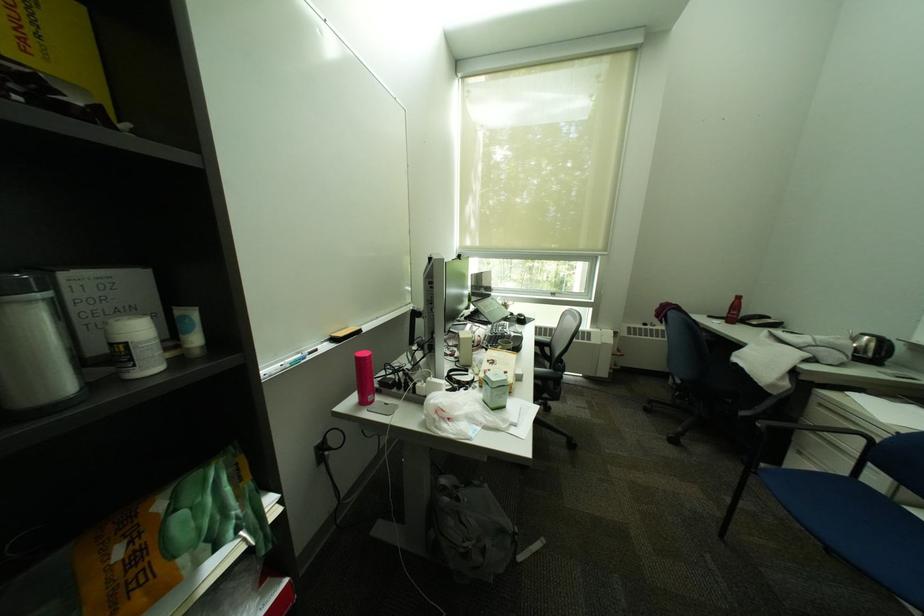
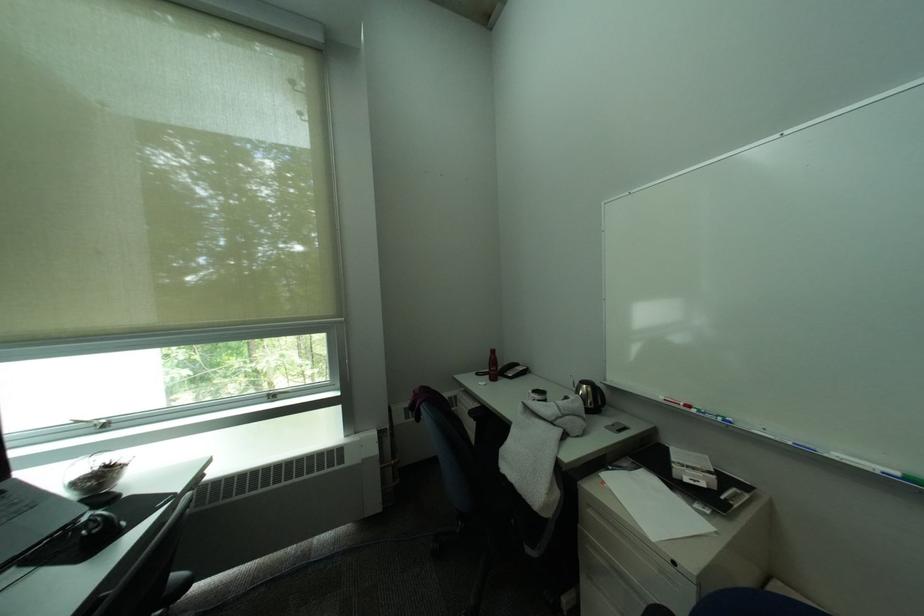
Locate, in the second image, the point that corresponds to (533,318) in the first image.

(106, 528)